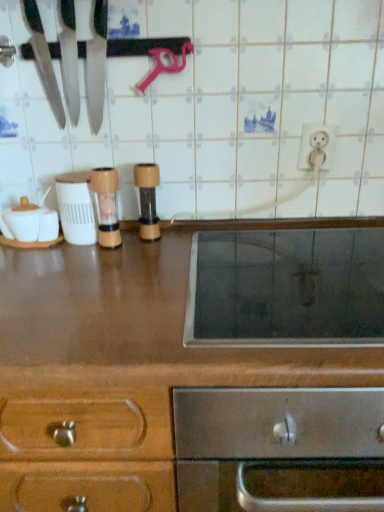
Question: Can you confirm if brown wood pepper grinder at center, which appears as the third appliance when viewed from the left, is smaller than white glossy electric outlet at upper right?

Choices:
 (A) yes
 (B) no

Answer: (B)

Question: Is brown wood pepper grinder at center, the first appliance when ordered from right to left, surrounding white glossy electric outlet at upper right?

Choices:
 (A) no
 (B) yes

Answer: (A)

Question: Is brown wood pepper grinder at center, which appears as the third appliance when viewed from the left, beside white glossy electric outlet at upper right?

Choices:
 (A) no
 (B) yes

Answer: (A)

Question: Is brown wood pepper grinder at center, the first appliance when ordered from right to left, wider than white glossy electric outlet at upper right?

Choices:
 (A) yes
 (B) no

Answer: (A)

Question: From a real-world perspective, is brown wood pepper grinder at center, which appears as the third appliance when viewed from the left, located beneath white glossy electric outlet at upper right?

Choices:
 (A) no
 (B) yes

Answer: (B)

Question: Is brown wood pepper grinder at center, which appears as the third appliance when viewed from the left, at the right side of white glossy electric outlet at upper right?

Choices:
 (A) no
 (B) yes

Answer: (A)

Question: Is white plastic container at center, which is the first appliance from left to right, looking in the opposite direction of brown wood pepper grinder at center, the first appliance when ordered from right to left?

Choices:
 (A) yes
 (B) no

Answer: (B)

Question: From a real-world perspective, is white plastic container at center, placed as the 3th appliance when sorted from right to left, on top of brown wood pepper grinder at center, which appears as the third appliance when viewed from the left?

Choices:
 (A) yes
 (B) no

Answer: (B)

Question: Is white plastic container at center, placed as the 3th appliance when sorted from right to left, at the left side of brown wood pepper grinder at center, the first appliance when ordered from right to left?

Choices:
 (A) yes
 (B) no

Answer: (A)

Question: Can you confirm if white plastic container at center, which is the first appliance from left to right, is taller than brown wood pepper grinder at center, which appears as the third appliance when viewed from the left?

Choices:
 (A) yes
 (B) no

Answer: (B)

Question: From the image's perspective, is white plastic container at center, which is the first appliance from left to right, on brown wood pepper grinder at center, the first appliance when ordered from right to left?

Choices:
 (A) no
 (B) yes

Answer: (A)

Question: From the image's perspective, does white plastic container at center, placed as the 3th appliance when sorted from right to left, appear lower than brown wood pepper grinder at center, which appears as the third appliance when viewed from the left?

Choices:
 (A) yes
 (B) no

Answer: (A)

Question: Is the position of wooden pepper grinder at center, the second appliance in the left-to-right sequence, more distant than that of white plastic container at center, which is the first appliance from left to right?

Choices:
 (A) no
 (B) yes

Answer: (A)